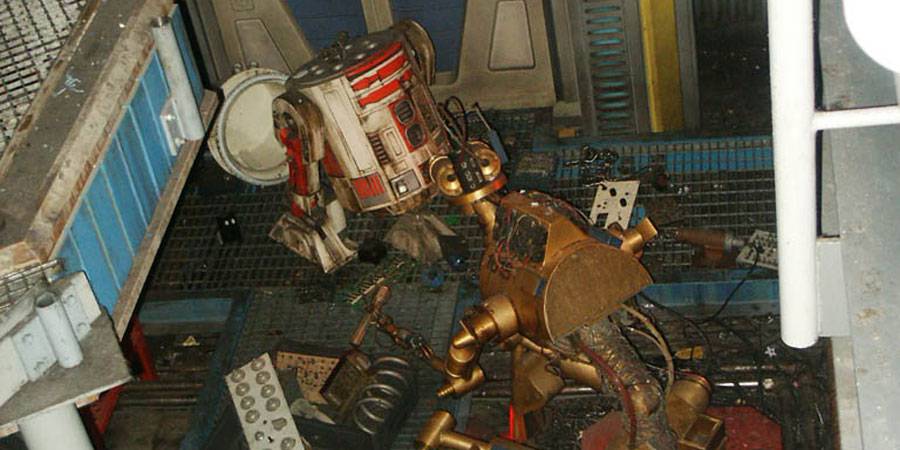
The image size is (900, 450). What are the coordinates of `left wall` in the screenshot? It's located at (115, 221).